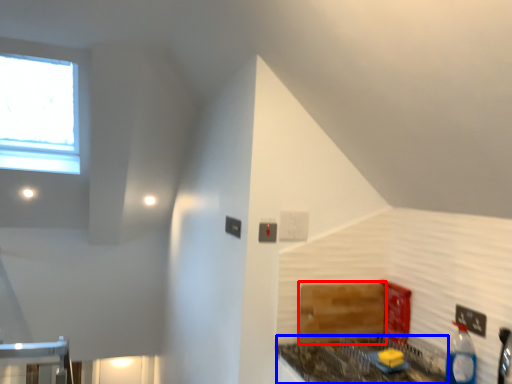
Question: Among these objects, which one is farthest to the camera, cabinetry (highlighted by a red box) or counter top (highlighted by a blue box)?

Choices:
 (A) cabinetry
 (B) counter top

Answer: (A)